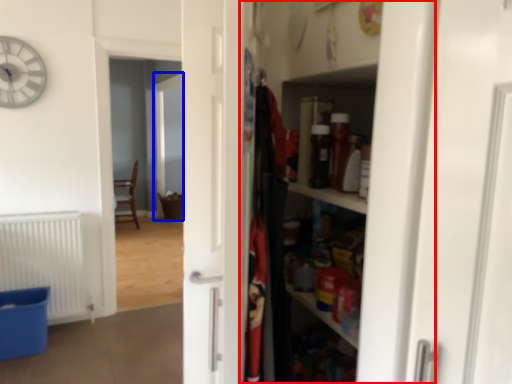
Question: Which point is closer to the camera, dresser (highlighted by a red box) or screen door (highlighted by a blue box)?

Choices:
 (A) dresser
 (B) screen door

Answer: (A)